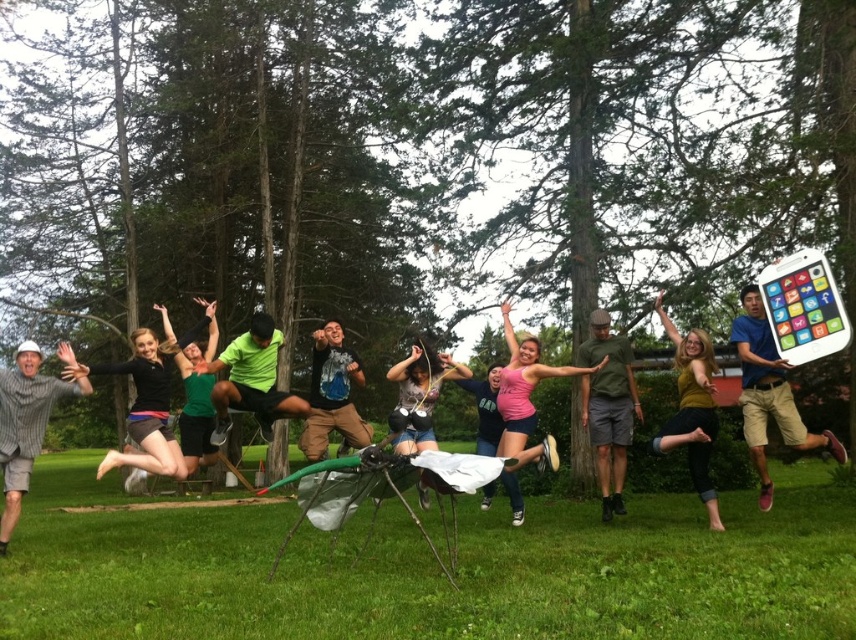
Who is more distant from viewer, (767, 356) or (62, 342)?

Positioned behind is point (62, 342).

Is point (770, 374) more distant than point (19, 426)?

No, it is in front of (19, 426).

The width and height of the screenshot is (856, 640). I want to click on white matte tablet at center, so click(x=768, y=392).

Is black matte shorts at center further to the viewer compared to green matte shorts at center?

No, black matte shorts at center is closer to the viewer.

What do you see at coordinates (144, 406) in the screenshot?
I see `black matte shorts at center` at bounding box center [144, 406].

Which is behind, point (110, 465) or point (604, 468)?

The point (604, 468) is behind.

Identify the location of black matte shorts at center. pyautogui.click(x=144, y=406).

Does black matte shorts at center appear on the left side of pink matte shirt at center?

Yes, black matte shorts at center is to the left of pink matte shirt at center.

Is black matte shorts at center further to the viewer compared to pink matte shirt at center?

No.

Measure the distance between point (179, 445) and camera.

Point (179, 445) is 21.00 feet away from camera.

In order to click on black matte shorts at center in this screenshot , I will do `click(144, 406)`.